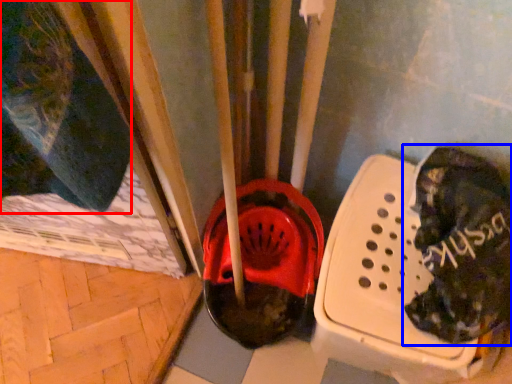
Question: Which object appears closest to the camera in this image, clothing (highlighted by a red box) or footwear (highlighted by a blue box)?

Choices:
 (A) clothing
 (B) footwear

Answer: (A)